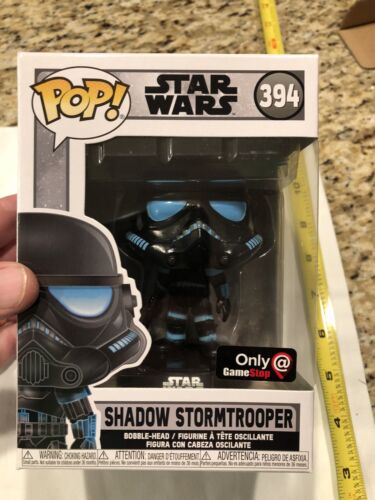
Where is `plastic window`? Image resolution: width=375 pixels, height=500 pixels. plastic window is located at coordinates (272, 273).